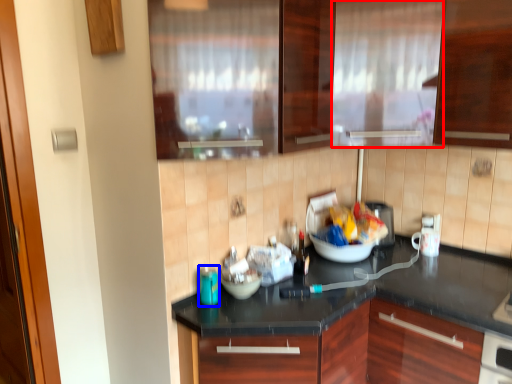
Question: Among these objects, which one is farthest to the camera, curtain (highlighted by a red box) or appliance (highlighted by a blue box)?

Choices:
 (A) curtain
 (B) appliance

Answer: (A)